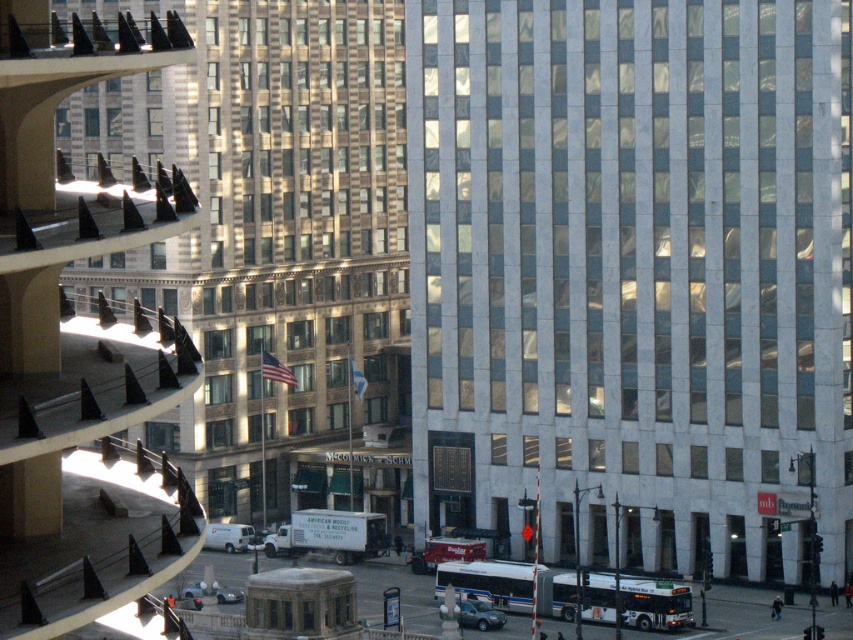
Does white marble building at center have a greater width compared to gold textured building at center?

In fact, white marble building at center might be narrower than gold textured building at center.

The image size is (853, 640). What do you see at coordinates (635, 273) in the screenshot?
I see `white marble building at center` at bounding box center [635, 273].

Is point (465, 243) more distant than point (289, 26)?

No, (465, 243) is in front of (289, 26).

Identify the location of white marble building at center. (635, 273).